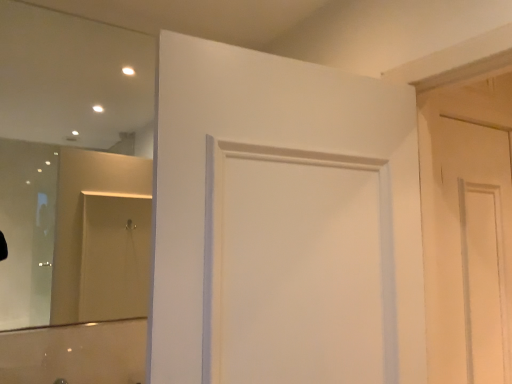
Question: Would you say white matte door at center, the 2th door positioned from the right, contains clear glass mirror at upper left?

Choices:
 (A) no
 (B) yes

Answer: (A)

Question: Considering the relative sizes of white matte door at center, which ranks as the second door in back-to-front order, and clear glass mirror at upper left in the image provided, is white matte door at center, which ranks as the second door in back-to-front order, shorter than clear glass mirror at upper left?

Choices:
 (A) no
 (B) yes

Answer: (B)

Question: Is clear glass mirror at upper left at the back of white matte door at center, which ranks as the second door in back-to-front order?

Choices:
 (A) yes
 (B) no

Answer: (A)

Question: From the image's perspective, would you say white matte door at center, acting as the 1th door starting from the front, is positioned over clear glass mirror at upper left?

Choices:
 (A) yes
 (B) no

Answer: (B)

Question: Considering the relative sizes of white matte door at center, which ranks as the second door in back-to-front order, and clear glass mirror at upper left in the image provided, is white matte door at center, which ranks as the second door in back-to-front order, bigger than clear glass mirror at upper left?

Choices:
 (A) yes
 (B) no

Answer: (A)

Question: From the image's perspective, relative to white matte door at right, placed as the first door when sorted from right to left, is white matte door at center, which ranks as the second door in back-to-front order, above or below?

Choices:
 (A) above
 (B) below

Answer: (A)

Question: Is white matte door at center, the first door viewed from the left, to the left or to the right of white matte door at right, placed as the first door when sorted from back to front, in the image?

Choices:
 (A) right
 (B) left

Answer: (B)

Question: In terms of width, does white matte door at center, acting as the 1th door starting from the front, look wider or thinner when compared to white matte door at right, placed as the first door when sorted from back to front?

Choices:
 (A) wide
 (B) thin

Answer: (A)

Question: Is white matte door at center, which ranks as the second door in back-to-front order, inside or outside of white matte door at right, the second door from the front?

Choices:
 (A) inside
 (B) outside

Answer: (B)

Question: Is point (117, 64) positioned closer to the camera than point (332, 134)?

Choices:
 (A) farther
 (B) closer

Answer: (A)

Question: In terms of width, does clear glass mirror at upper left look wider or thinner when compared to white matte door at center, the 2th door positioned from the right?

Choices:
 (A) thin
 (B) wide

Answer: (A)

Question: Considering the positions of clear glass mirror at upper left and white matte door at center, the first door viewed from the left, in the image, is clear glass mirror at upper left taller or shorter than white matte door at center, the first door viewed from the left,?

Choices:
 (A) short
 (B) tall

Answer: (B)

Question: From the image's perspective, relative to white matte door at center, which ranks as the second door in back-to-front order, is clear glass mirror at upper left above or below?

Choices:
 (A) below
 (B) above

Answer: (B)

Question: Is white matte door at center, which ranks as the second door in back-to-front order, to the left or to the right of clear glass mirror at upper left in the image?

Choices:
 (A) right
 (B) left

Answer: (A)

Question: Is white matte door at center, which ranks as the second door in back-to-front order, spatially inside clear glass mirror at upper left, or outside of it?

Choices:
 (A) inside
 (B) outside

Answer: (B)